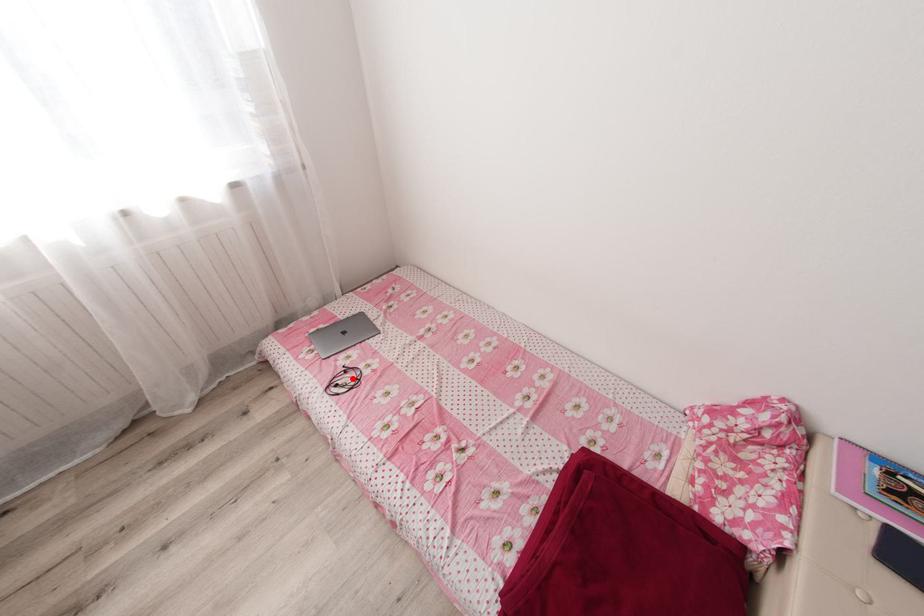
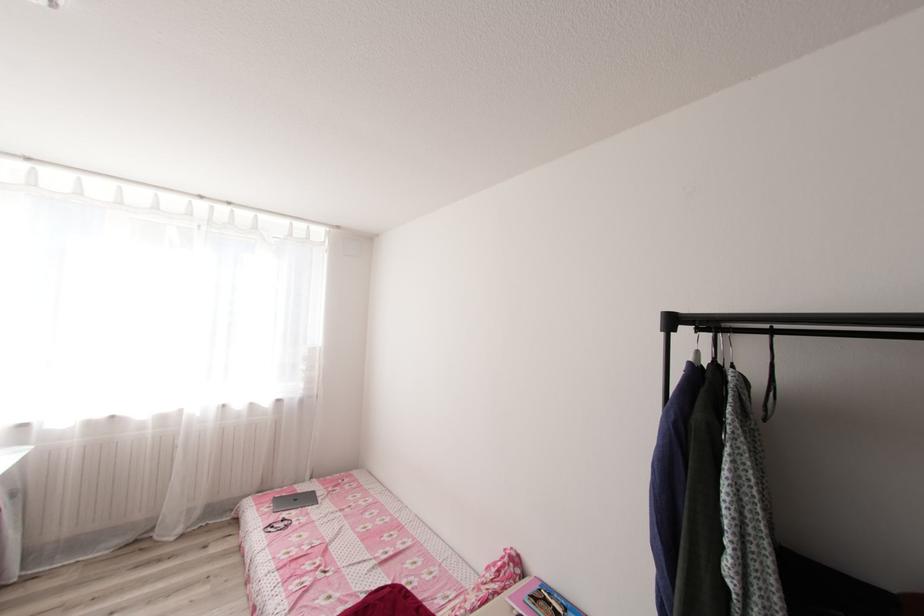
Find the pixel in the second image that matches the highlighted location in the first image.

(286, 525)